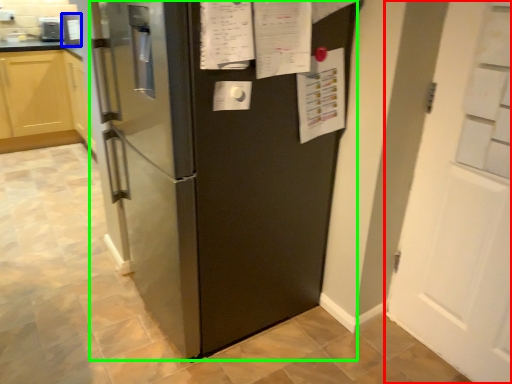
Question: Which object is positioned farthest from door (highlighted by a red box)? Select from appliance (highlighted by a blue box) and refrigerator (highlighted by a green box).

Choices:
 (A) appliance
 (B) refrigerator

Answer: (A)